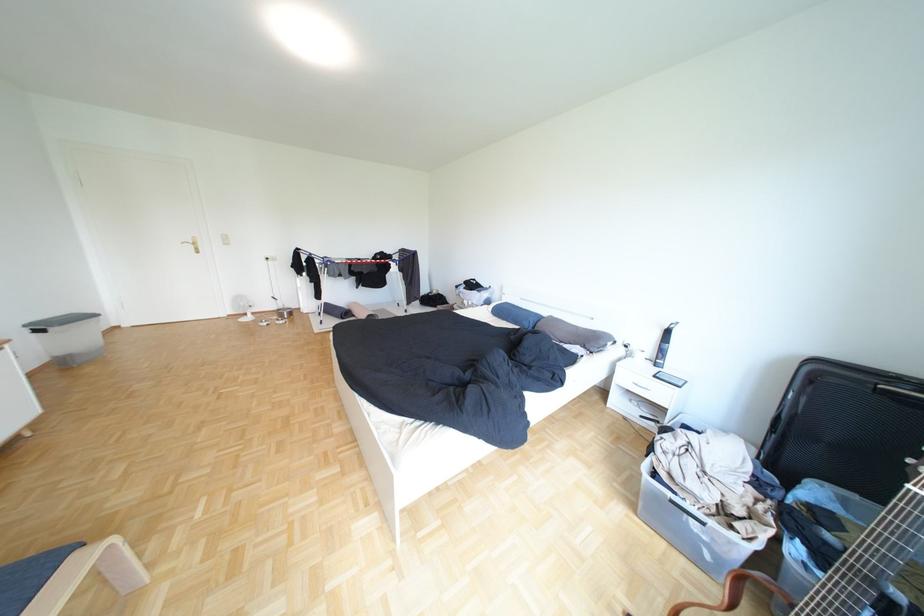
Which object does [66,575] point to?

It corresponds to the rolled yoga mat in the image.